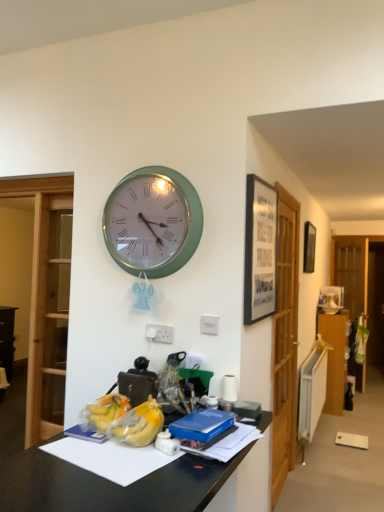
Question: Is black matte picture frame at upper right, placed as the first picture frame when sorted from front to back, inside matte black picture frame at upper right, placed as the first picture frame when sorted from back to front?

Choices:
 (A) no
 (B) yes

Answer: (A)

Question: Could you tell me if matte black picture frame at upper right, placed as the first picture frame when sorted from back to front, is turned towards black matte picture frame at upper right, the 1th picture frame from the left?

Choices:
 (A) yes
 (B) no

Answer: (B)

Question: Is matte black picture frame at upper right, which is the first picture frame in right-to-left order, oriented away from black matte picture frame at upper right, placed as the first picture frame when sorted from front to back?

Choices:
 (A) yes
 (B) no

Answer: (B)

Question: From a real-world perspective, is matte black picture frame at upper right, which is counted as the second picture frame, starting from the front, located higher than black matte picture frame at upper right, which is the second picture frame in right-to-left order?

Choices:
 (A) yes
 (B) no

Answer: (A)

Question: Is the surface of matte black picture frame at upper right, arranged as the 2th picture frame when viewed from the left, in direct contact with black matte picture frame at upper right, placed as the first picture frame when sorted from front to back?

Choices:
 (A) no
 (B) yes

Answer: (A)

Question: Is transparent wooden door at right, which is the 1th glass door in back-to-front order, spatially inside translucent plastic bananas at center, or outside of it?

Choices:
 (A) outside
 (B) inside

Answer: (A)

Question: Is transparent wooden door at right, which appears as the 2th glass door when viewed from the front, bigger or smaller than translucent plastic bananas at center?

Choices:
 (A) small
 (B) big

Answer: (B)

Question: Is transparent wooden door at right, the first glass door viewed from the right, in front of or behind translucent plastic bananas at center in the image?

Choices:
 (A) behind
 (B) front

Answer: (A)

Question: Considering the relative positions of transparent wooden door at right, positioned as the second glass door in left-to-right order, and translucent plastic bananas at center in the image provided, is transparent wooden door at right, positioned as the second glass door in left-to-right order, to the left or to the right of translucent plastic bananas at center?

Choices:
 (A) right
 (B) left

Answer: (A)

Question: In the image, is transparent wooden door at right, which appears as the 2th glass door when viewed from the front, positioned in front of or behind green metallic wall clock at upper center?

Choices:
 (A) behind
 (B) front

Answer: (A)

Question: From the image's perspective, is transparent wooden door at right, which appears as the 2th glass door when viewed from the front, above or below green metallic wall clock at upper center?

Choices:
 (A) below
 (B) above

Answer: (A)

Question: Which is correct: transparent wooden door at right, the first glass door viewed from the right, is inside green metallic wall clock at upper center, or outside of it?

Choices:
 (A) outside
 (B) inside

Answer: (A)

Question: From a real-world perspective, relative to green metallic wall clock at upper center, is transparent wooden door at right, the first glass door viewed from the right, vertically above or below?

Choices:
 (A) above
 (B) below

Answer: (B)

Question: From a real-world perspective, is matte black picture frame at upper right, placed as the first picture frame when sorted from back to front, physically located above or below wooden dresser at right?

Choices:
 (A) above
 (B) below

Answer: (A)

Question: Which is correct: matte black picture frame at upper right, which is counted as the second picture frame, starting from the front, is inside wooden dresser at right, or outside of it?

Choices:
 (A) inside
 (B) outside

Answer: (B)